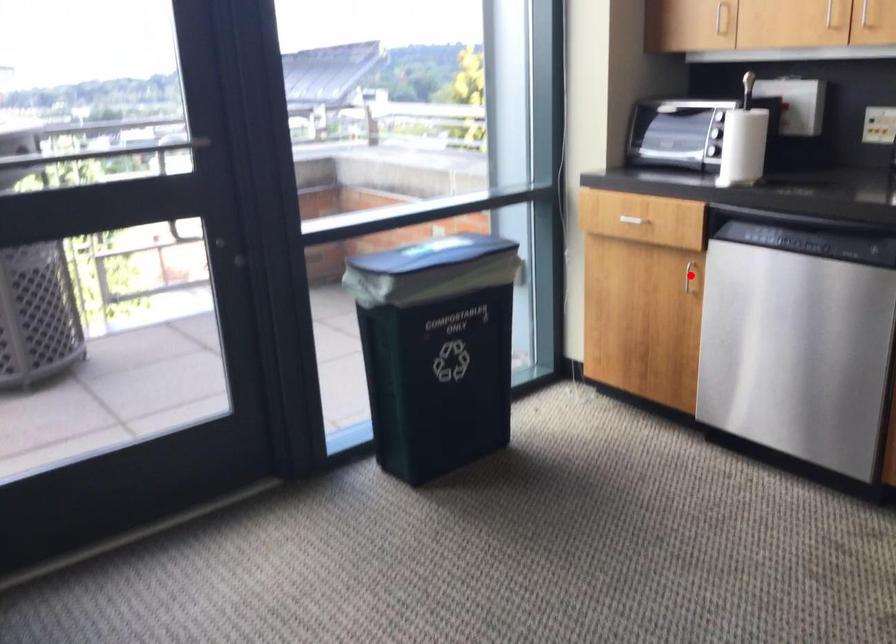
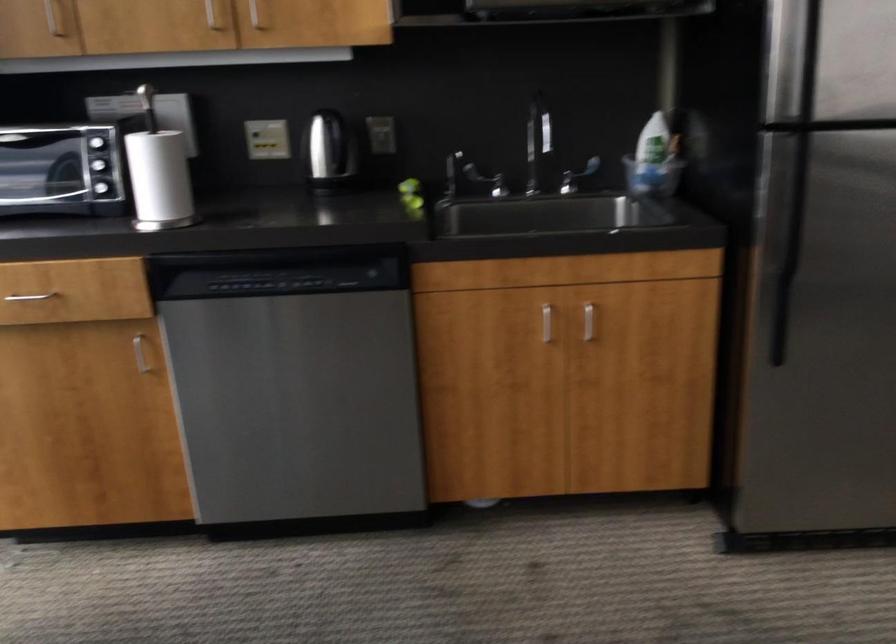
Question: I am providing you with two images of the same scene from different viewpoints. A red point is shown in image1. For the corresponding object point in image2, is it positioned nearer or farther from the camera?

Choices:
 (A) Nearer
 (B) Farther

Answer: (A)